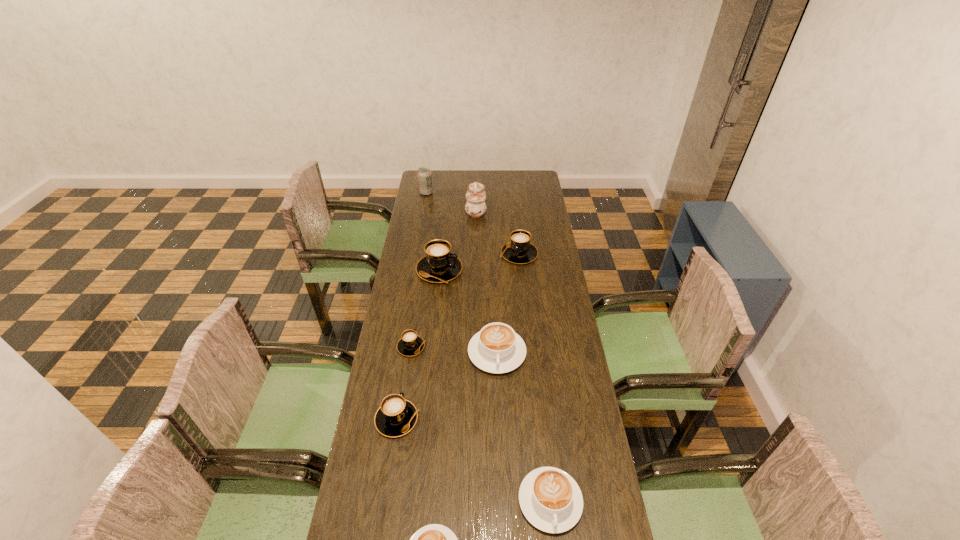
You are a GUI agent. You are given a task and a screenshot of the screen. Output one action in this format:
    pyautogui.click(x=<x>, y=<y>)
    Task: Click on the chinaware
    Image resolution: width=960 pixels, height=540 pixels.
    Given the screenshot: What is the action you would take?
    pyautogui.click(x=475, y=207)

Where is `white chinaware`? white chinaware is located at coordinates (475, 207).

Image resolution: width=960 pixels, height=540 pixels. I want to click on the farthest object, so click(x=424, y=174).

What are the coordinates of `gray soda can` in the screenshot? It's located at (424, 174).

You are a GUI agent. You are given a task and a screenshot of the screen. Output one action in this format:
    pyautogui.click(x=<x>, y=<y>)
    Task: Click on the biggest black cappuccino
    The image size is (960, 540).
    Given the screenshot: What is the action you would take?
    pyautogui.click(x=439, y=265)

In order to click on the second biggest black cappuccino in this screenshot , I will do `click(519, 250)`.

The height and width of the screenshot is (540, 960). What are the coordinates of `the farthest white cappuccino` in the screenshot? It's located at (496, 348).

You are a GUI agent. You are given a task and a screenshot of the screen. Output one action in this format:
    pyautogui.click(x=<x>, y=<y>)
    Task: Click on the seventh farthest object
    The width and height of the screenshot is (960, 540).
    Given the screenshot: What is the action you would take?
    pyautogui.click(x=396, y=416)

You are a GUI agent. You are given a task and a screenshot of the screen. Output one action in this format:
    pyautogui.click(x=<x>, y=<y>)
    Task: Click on the second smallest black cappuccino
    Image resolution: width=960 pixels, height=540 pixels.
    Given the screenshot: What is the action you would take?
    pyautogui.click(x=396, y=416)

Locate an element on the screen. the second smallest white cappuccino is located at coordinates (550, 499).